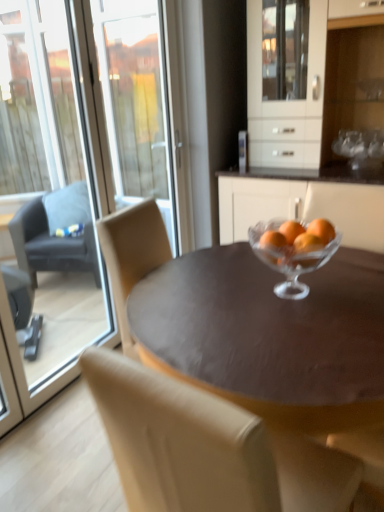
Question: Is the position of dark gray fabric chair at left, arranged as the 1th chair when viewed from the back, less distant than that of clear glass bowl at center?

Choices:
 (A) yes
 (B) no

Answer: (B)

Question: Does dark gray fabric chair at left, which appears as the first chair when viewed from the left, turn towards clear glass bowl at center?

Choices:
 (A) no
 (B) yes

Answer: (A)

Question: Is the depth of dark gray fabric chair at left, the 2th chair positioned from the front, greater than that of clear glass bowl at center?

Choices:
 (A) yes
 (B) no

Answer: (A)

Question: From a real-world perspective, is dark gray fabric chair at left, which appears as the first chair when viewed from the left, under clear glass bowl at center?

Choices:
 (A) yes
 (B) no

Answer: (A)

Question: From a real-world perspective, is dark gray fabric chair at left, the 2th chair positioned from the front, on top of clear glass bowl at center?

Choices:
 (A) no
 (B) yes

Answer: (A)

Question: Does dark gray fabric chair at left, the 1th chair from the top, touch clear glass bowl at center?

Choices:
 (A) yes
 (B) no

Answer: (B)

Question: Is white glossy cabinet at upper center outside orangesmooth glassbowl at center?

Choices:
 (A) yes
 (B) no

Answer: (A)

Question: Is white glossy cabinet at upper center wider than orangesmooth glassbowl at center?

Choices:
 (A) no
 (B) yes

Answer: (B)

Question: Does white glossy cabinet at upper center have a lesser width compared to orangesmooth glassbowl at center?

Choices:
 (A) yes
 (B) no

Answer: (B)

Question: From a real-world perspective, is white glossy cabinet at upper center positioned over orangesmooth glassbowl at center based on gravity?

Choices:
 (A) yes
 (B) no

Answer: (A)

Question: Is white glossy cabinet at upper center smaller than orangesmooth glassbowl at center?

Choices:
 (A) yes
 (B) no

Answer: (B)

Question: Is white glossy cabinet at upper center facing towards orangesmooth glassbowl at center?

Choices:
 (A) no
 (B) yes

Answer: (B)

Question: Are dark gray fabric chair at left, arranged as the 1th chair when viewed from the back, and orangesmooth glassbowl at center beside each other?

Choices:
 (A) yes
 (B) no

Answer: (B)